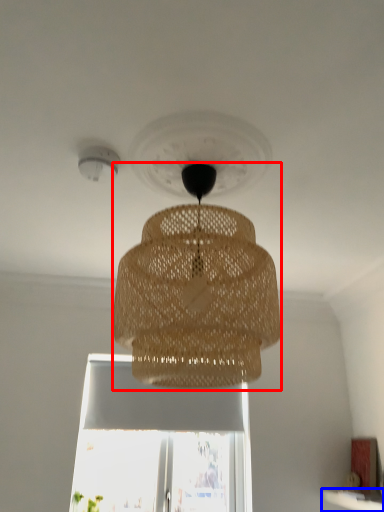
Question: Which object appears farthest to the camera in this image, lamp (highlighted by a red box) or window sill (highlighted by a blue box)?

Choices:
 (A) lamp
 (B) window sill

Answer: (B)